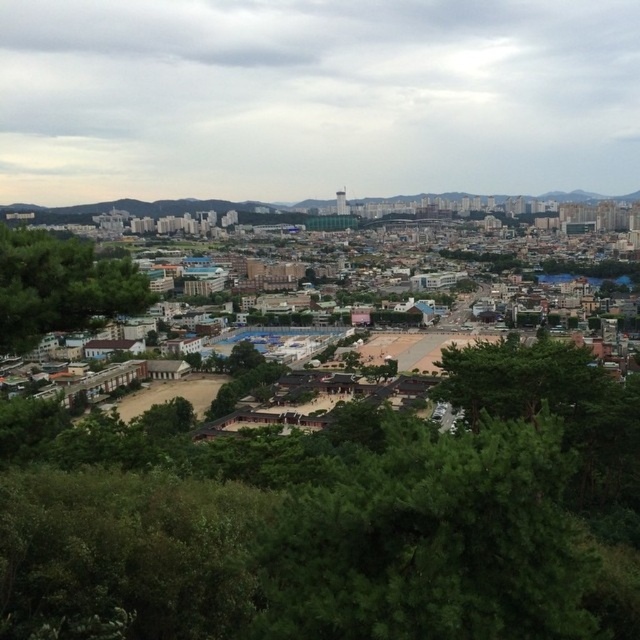
You are a hiker who wants to take a photo of the cityscape. You notice two green leafy trees in your viewfinder. The green leafy tree at center and the green leafy tree at lower left. Which tree should you focus on if you want the tree to appear larger in your photo?

The green leafy tree at lower left should be focused on because it is larger than the green leafy tree at center.

You are standing at the point closer to you in the image. Which point are you at, point (621, 465) or point (0, 262)?

You are at point (0, 262) because it is closer to the viewer than point (621, 465).

You are standing in the cityscape and want to take a photo of both the green leafy tree at center and the green leafy tree at lower left. Which tree should you position to your left to include both in the frame?

You should position the green leafy tree at lower left to your left because the green leafy tree at center is to the right of it, allowing both to be captured in the photo.